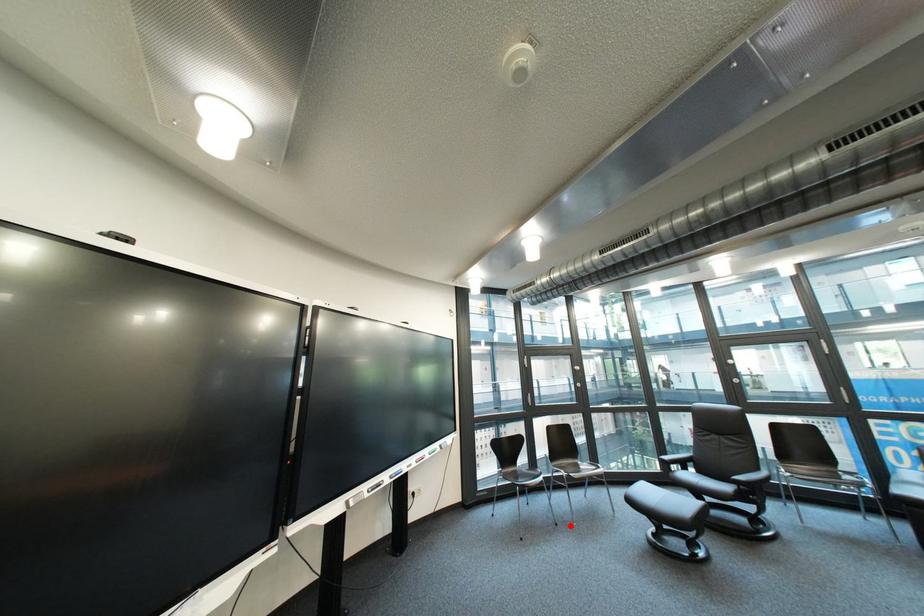
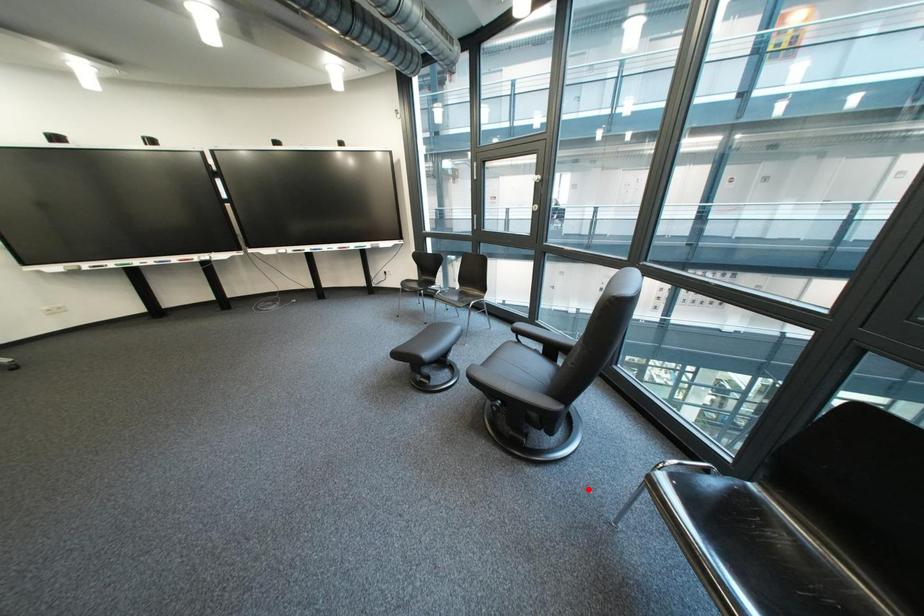
I am providing you with two images of the same scene from different viewpoints. A red point is marked on the first image and another point is marked on the second image. Is the marked point in image1 the same physical position as the marked point in image2?

No